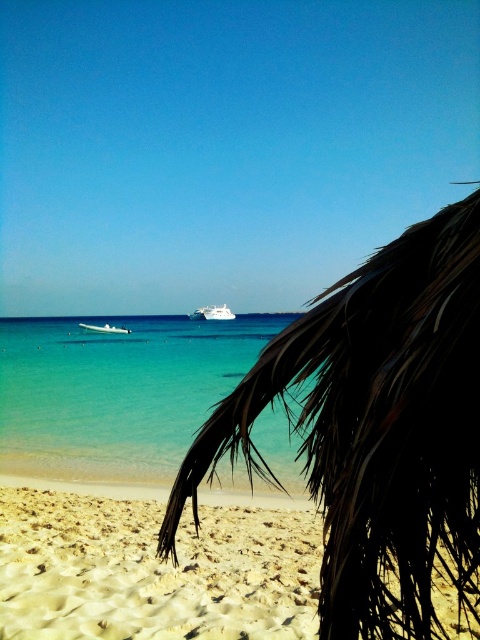
Question: Which object appears closest to the camera in this image?

Choices:
 (A) white glossy cruise ship at center
 (B) dark brown fronds at center

Answer: (B)

Question: Which object is the closest to the white glossy boat at center?

Choices:
 (A) dark brown fronds at center
 (B) clear blue water at center
 (C) beige sandy beach at lower left

Answer: (B)

Question: Does beige sandy beach at lower left come in front of white glossy boat at center?

Choices:
 (A) no
 (B) yes

Answer: (B)

Question: Which point appears closest to the camera in this image?

Choices:
 (A) (0, 342)
 (B) (215, 605)
 (C) (202, 310)
 (D) (120, 328)

Answer: (B)

Question: Is white glossy cruise ship at center closer to camera compared to white glossy boat at center?

Choices:
 (A) yes
 (B) no

Answer: (B)

Question: Does clear blue water at center come in front of white glossy cruise ship at center?

Choices:
 (A) no
 (B) yes

Answer: (B)